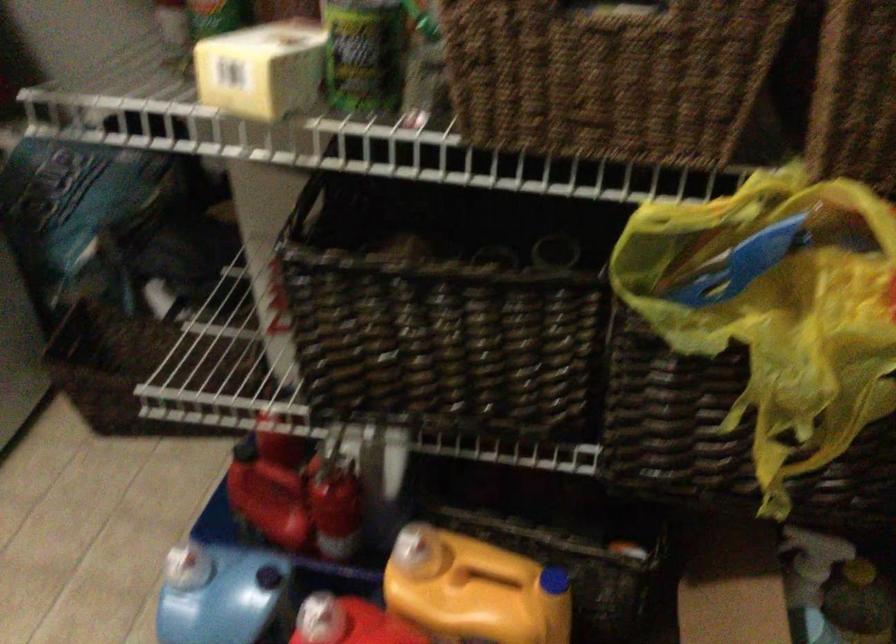
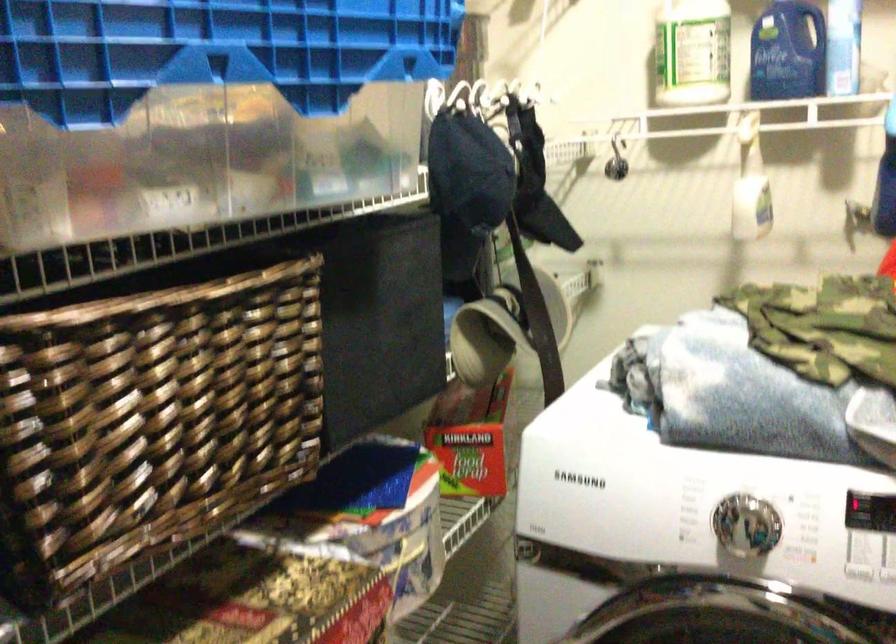
How did the camera likely rotate?

The camera rotated toward left-down.